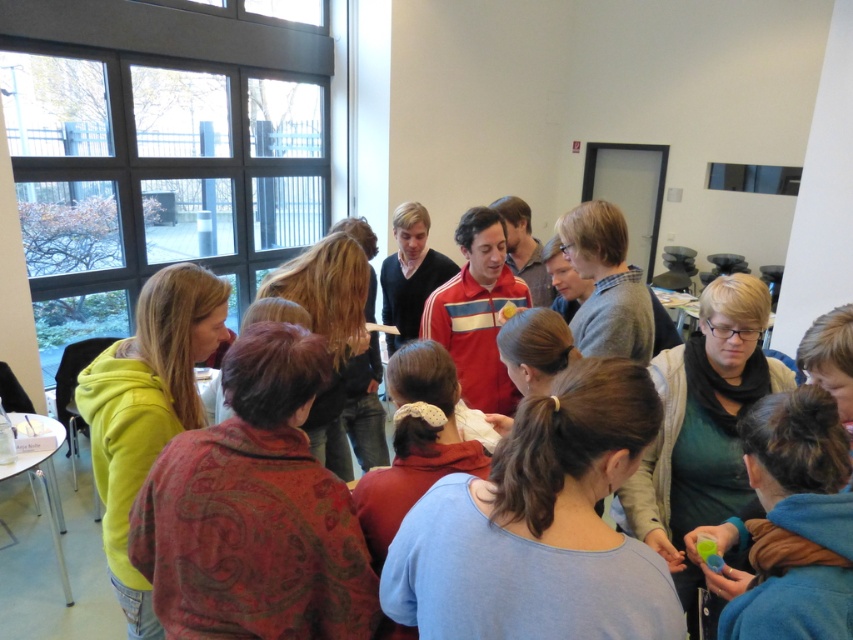
You are taking a photo of two points in the scene described. The first point is labeled as point (434, 536) and the second is point (120, 387). If you want to focus on the point that is closer to the camera, which point should you choose?

You should choose point (434, 536) because it is closer to the camera than point (120, 387).

You are organizing a clothing swap event and need to ensure that all items fit into a standard wardrobe. The wardrobe has a width limit of 40 cm per garment. You have a light blue fabric shirt at center and a matte yellow hoodie at left. Can both items fit within the wardrobe if placed side by side?

The light blue fabric shirt at center has a larger width than the matte yellow hoodie at left. Since the wardrobe allows 40 cm per garment, we need to check each individually. However, the description only states their relative sizes, not exact measurements. Without specific widths, we can only confirm that the matte yellow hoodie at left is narrower than the light blue fabric shirt at center. If the shirt exceeds 40 cm, both may not fit. If the shirt is under 40 cm, then both could potentially fit as the

You are standing in the room and want to reach the point marked as point (467, 508). If your walking speed is 3 feet per second, how many seconds will it take you to reach that point?

The distance between you and point (467, 508) is 3.39 feet. At a speed of 3 feet per second, it would take approximately 1.13 seconds to reach the point.